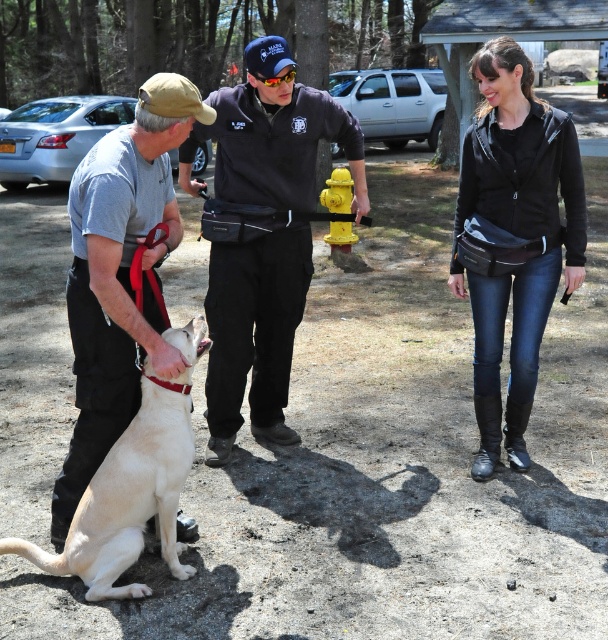
Question: Is black smooth uniform at center to the left of light yellow fur at center from the viewer's perspective?

Choices:
 (A) yes
 (B) no

Answer: (B)

Question: Is black smooth uniform at center wider than light beige fabric dog at left?

Choices:
 (A) no
 (B) yes

Answer: (B)

Question: Considering the real-world distances, which object is closest to the black leather jacket at center?

Choices:
 (A) black smooth uniform at center
 (B) yellow painted metal fire hydrant at center

Answer: (A)

Question: Which point appears closest to the camera in this image?

Choices:
 (A) (156, 413)
 (B) (502, 339)
 (C) (246, 189)
 (D) (345, 244)

Answer: (A)

Question: Which point is closer to the camera?

Choices:
 (A) (333, 208)
 (B) (143, 508)
 (C) (541, 192)

Answer: (B)

Question: Can you confirm if light yellow fur at center is smaller than yellow painted metal fire hydrant at center?

Choices:
 (A) yes
 (B) no

Answer: (B)